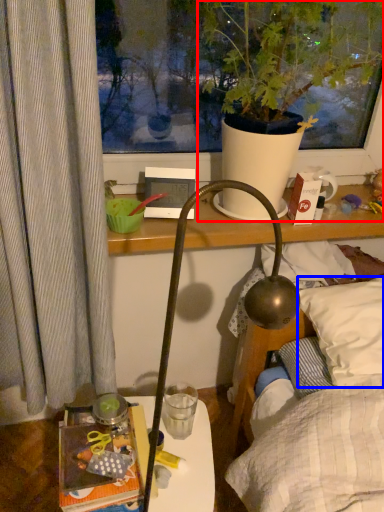
Question: Which point is further to the camera, houseplant (highlighted by a red box) or pillow (highlighted by a blue box)?

Choices:
 (A) houseplant
 (B) pillow

Answer: (B)